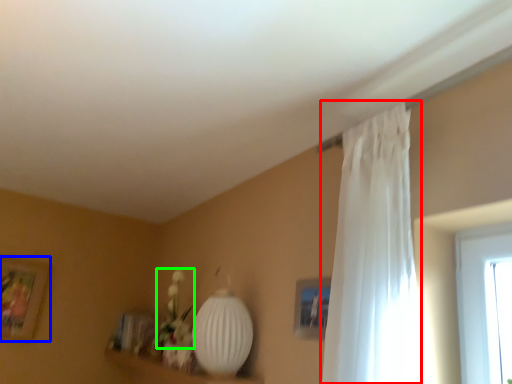
Question: Estimate the real-world distances between objects in this image. Which object is closer to curtain (highlighted by a red box), picture frame (highlighted by a blue box) or floral arrangement (highlighted by a green box)?

Choices:
 (A) picture frame
 (B) floral arrangement

Answer: (B)